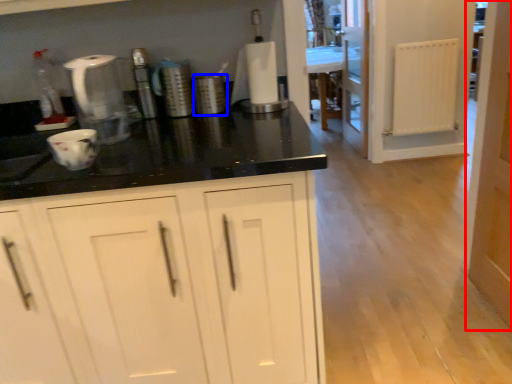
Question: Which object is further to the camera taking this photo, door (highlighted by a red box) or appliance (highlighted by a blue box)?

Choices:
 (A) door
 (B) appliance

Answer: (B)